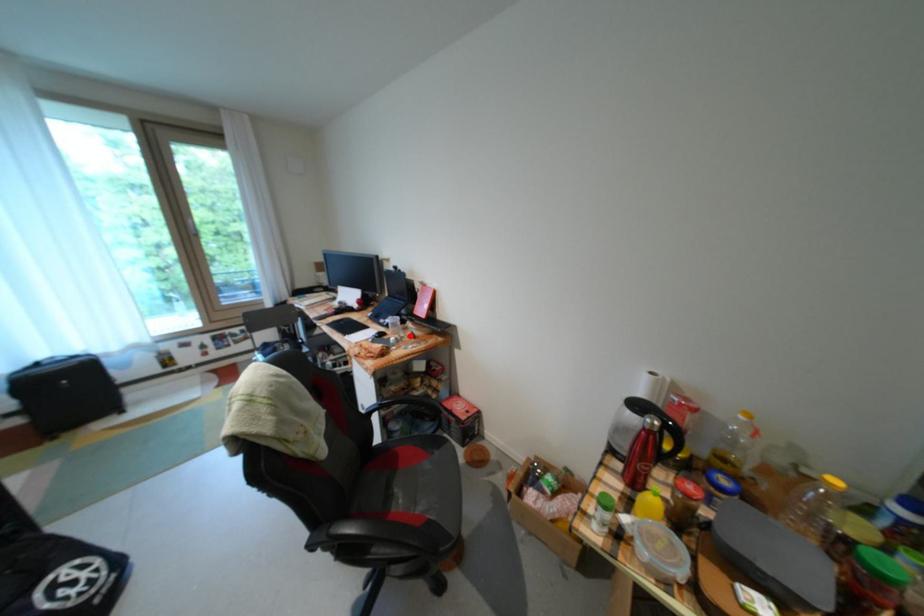
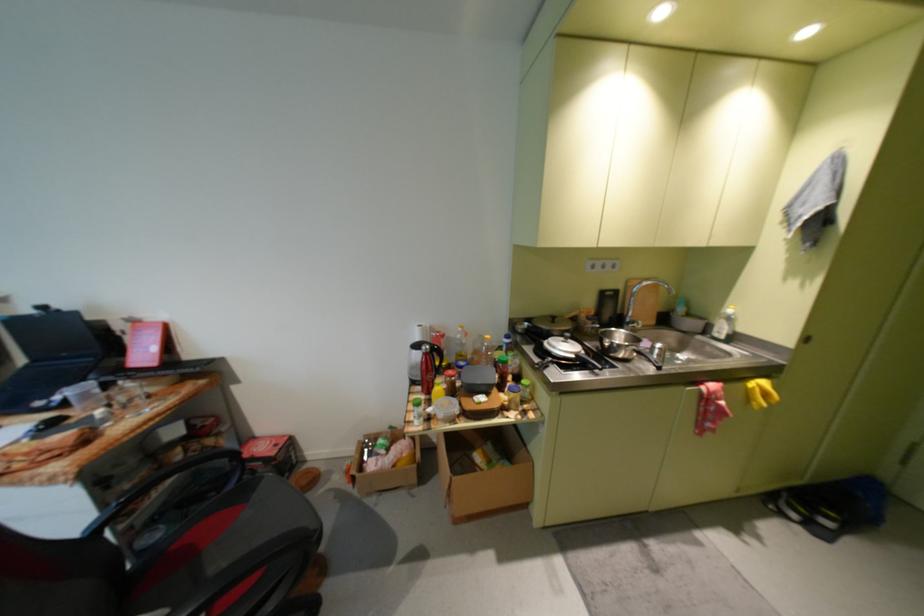
Find the pixel in the second image that matches the highlighted location in the first image.

(119, 407)